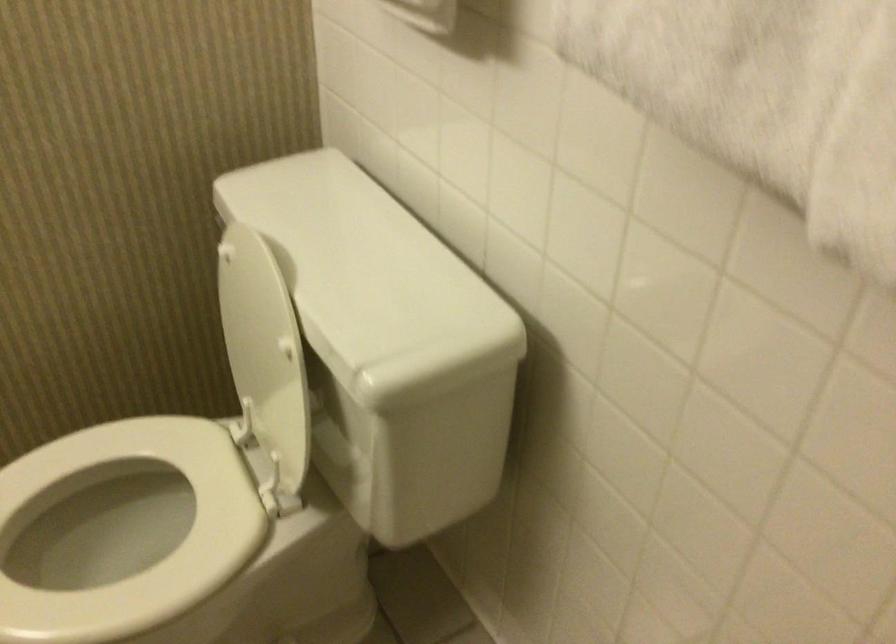
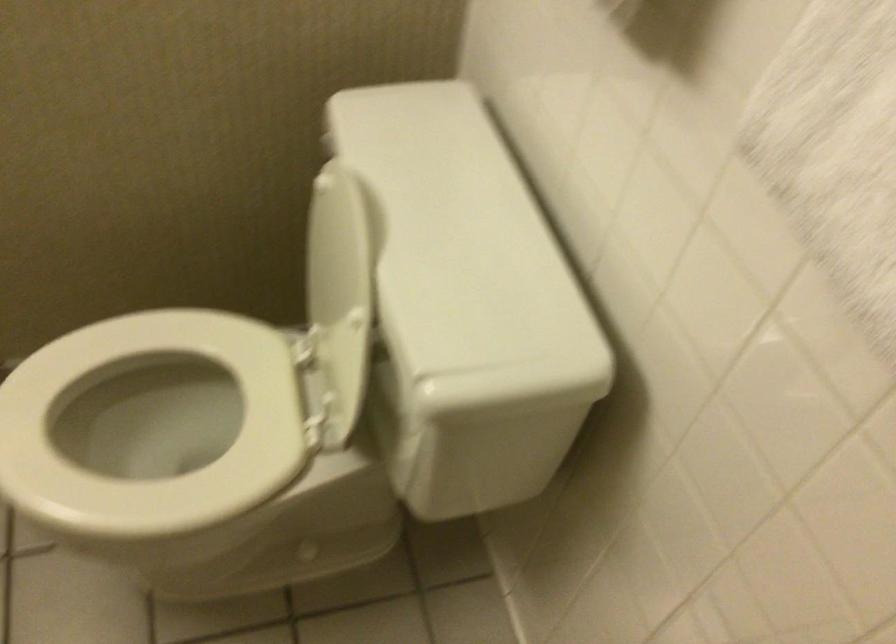
Question: Based on the continuous images, in which direction is the camera rotating? Reply with the corresponding letter.

Choices:
 (A) Left
 (B) Right
 (C) Up
 (D) Down

Answer: (D)